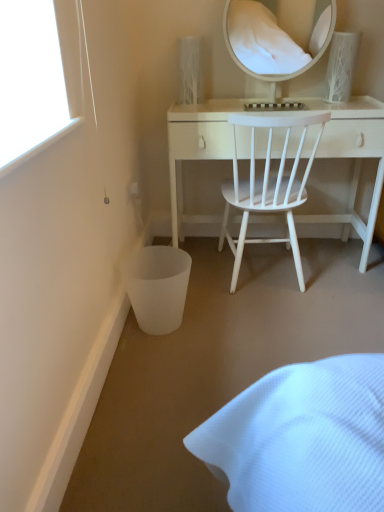
Question: Considering the relative positions of white textured vase at upper right and white glossy mirror at upper center in the image provided, is white textured vase at upper right to the left or to the right of white glossy mirror at upper center?

Choices:
 (A) left
 (B) right

Answer: (B)

Question: From a real-world perspective, is white textured vase at upper right positioned above or below white glossy mirror at upper center?

Choices:
 (A) above
 (B) below

Answer: (B)

Question: Based on their relative distances, which object is nearer to the white matte wood desk at center?

Choices:
 (A) white textured vase at upper right
 (B) white glossy mirror at upper center
 (C) white wood chair at center

Answer: (C)

Question: Estimate the real-world distances between objects in this image. Which object is closer to the white matte wood desk at center?

Choices:
 (A) white textured vase at upper right
 (B) white wood chair at center
 (C) white glossy mirror at upper center

Answer: (B)